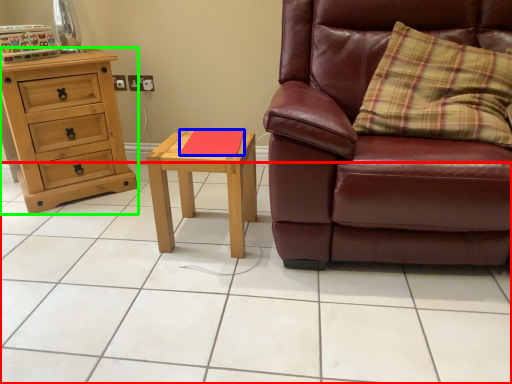
Question: Considering the real-world distances, which object is farthest from ceramic tile (highlighted by a red box)? pad (highlighted by a blue box) or chest of drawers (highlighted by a green box)?

Choices:
 (A) pad
 (B) chest of drawers

Answer: (B)